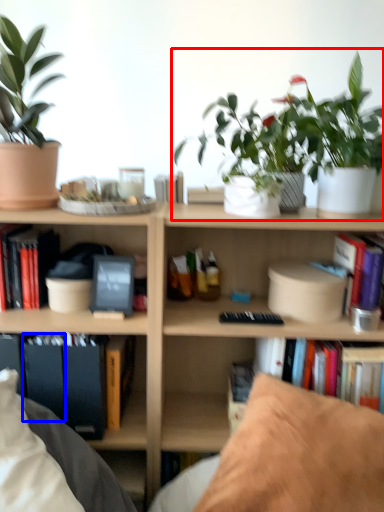
Question: Which object is further to the camera taking this photo, houseplant (highlighted by a red box) or paperback book (highlighted by a blue box)?

Choices:
 (A) houseplant
 (B) paperback book

Answer: (B)